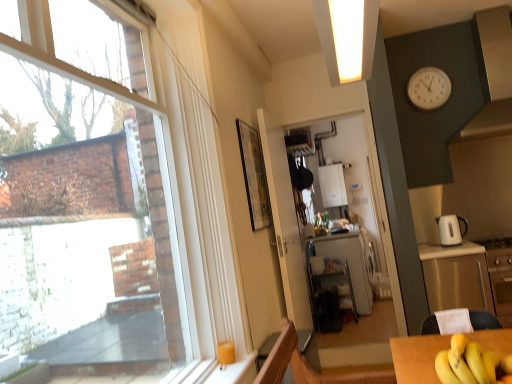
Question: Does white glossy exhaust hood at upper right have a greater height compared to white plastic clock at upper right?

Choices:
 (A) no
 (B) yes

Answer: (B)

Question: From the image's perspective, is white glossy exhaust hood at upper right on white plastic clock at upper right?

Choices:
 (A) yes
 (B) no

Answer: (A)

Question: Is white glossy exhaust hood at upper right behind white plastic clock at upper right?

Choices:
 (A) yes
 (B) no

Answer: (B)

Question: Can you confirm if white glossy exhaust hood at upper right is bigger than white plastic clock at upper right?

Choices:
 (A) yes
 (B) no

Answer: (A)

Question: Is white plastic clock at upper right completely or partially inside white glossy exhaust hood at upper right?

Choices:
 (A) no
 (B) yes

Answer: (A)

Question: Visually, is white glossy refrigerator at center positioned to the left or to the right of white glossy electric kettle at right?

Choices:
 (A) left
 (B) right

Answer: (A)

Question: Would you say white glossy refrigerator at center is inside or outside white glossy electric kettle at right?

Choices:
 (A) outside
 (B) inside

Answer: (A)

Question: In terms of height, does white glossy refrigerator at center look taller or shorter compared to white glossy electric kettle at right?

Choices:
 (A) tall
 (B) short

Answer: (A)

Question: Based on their sizes in the image, would you say white glossy refrigerator at center is bigger or smaller than white glossy electric kettle at right?

Choices:
 (A) big
 (B) small

Answer: (A)

Question: Do you think white glossy boiler at center is within white glossy exhaust hood at upper right, or outside of it?

Choices:
 (A) outside
 (B) inside

Answer: (A)

Question: Looking at their shapes, would you say white glossy boiler at center is wider or thinner than white glossy exhaust hood at upper right?

Choices:
 (A) thin
 (B) wide

Answer: (A)

Question: In the image, is white glossy boiler at center on the left side or the right side of white glossy exhaust hood at upper right?

Choices:
 (A) left
 (B) right

Answer: (A)

Question: In the image, is white glossy boiler at center positioned in front of or behind white glossy exhaust hood at upper right?

Choices:
 (A) behind
 (B) front

Answer: (A)

Question: Does point (448, 230) appear closer or farther from the camera than point (324, 183)?

Choices:
 (A) closer
 (B) farther

Answer: (A)

Question: From the image's perspective, relative to white glossy boiler at center, is white glossy electric kettle at right above or below?

Choices:
 (A) below
 (B) above

Answer: (A)